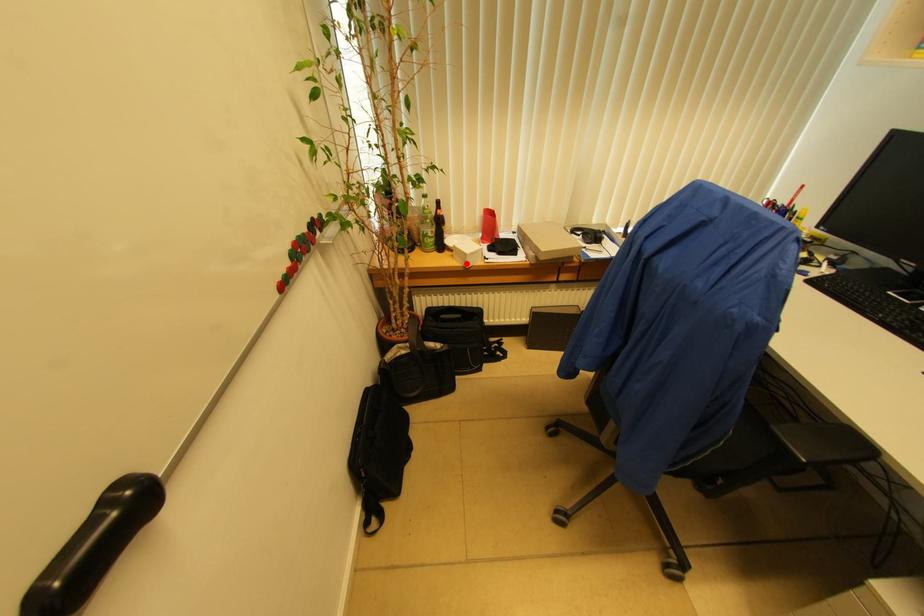
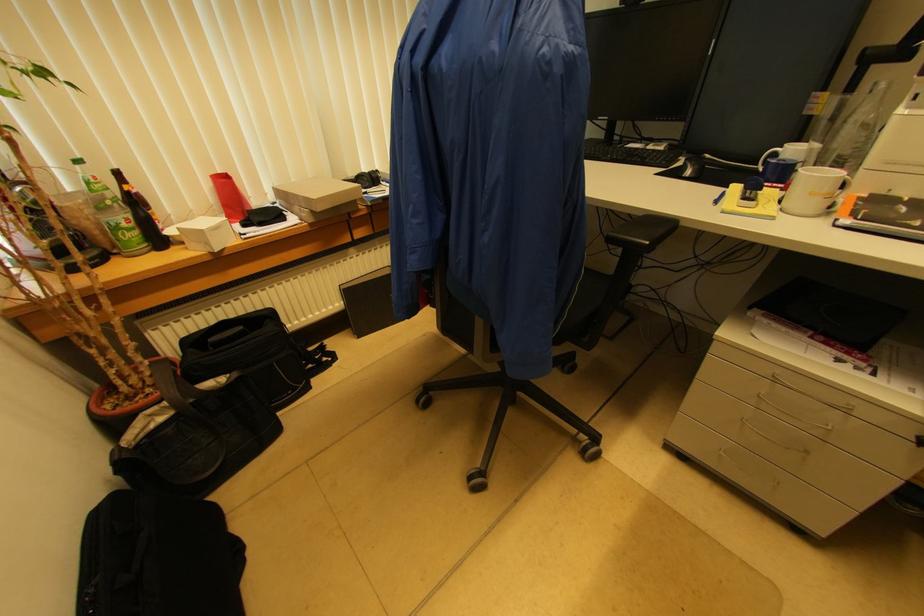
Locate, in the second image, the point that corresponds to the highlighted location in the first image.

(209, 246)